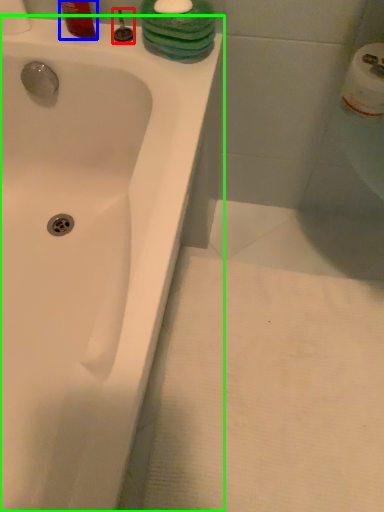
Question: Which is nearer to the plumbing fixture (highlighted by a red box)? liquid (highlighted by a blue box) or bathtub (highlighted by a green box).

Choices:
 (A) liquid
 (B) bathtub

Answer: (A)